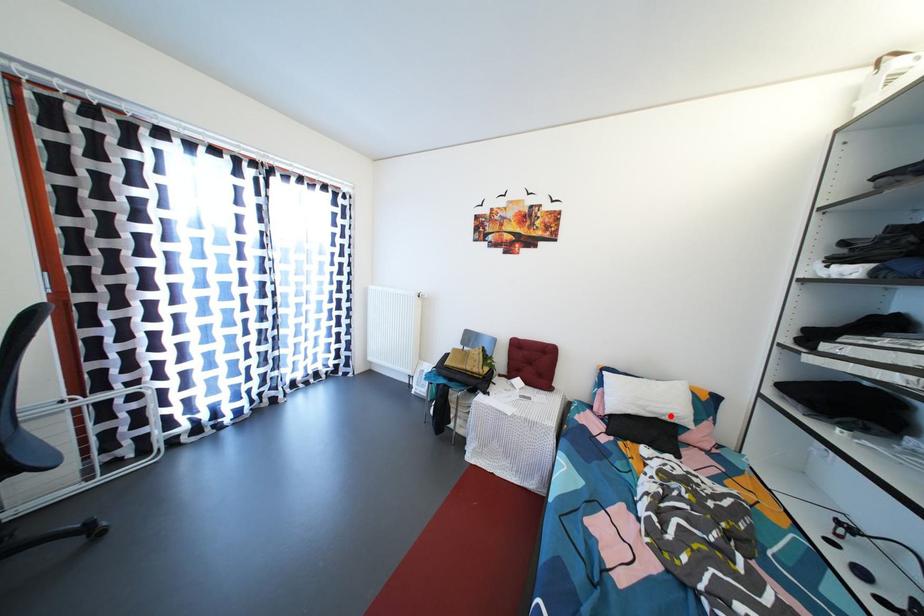
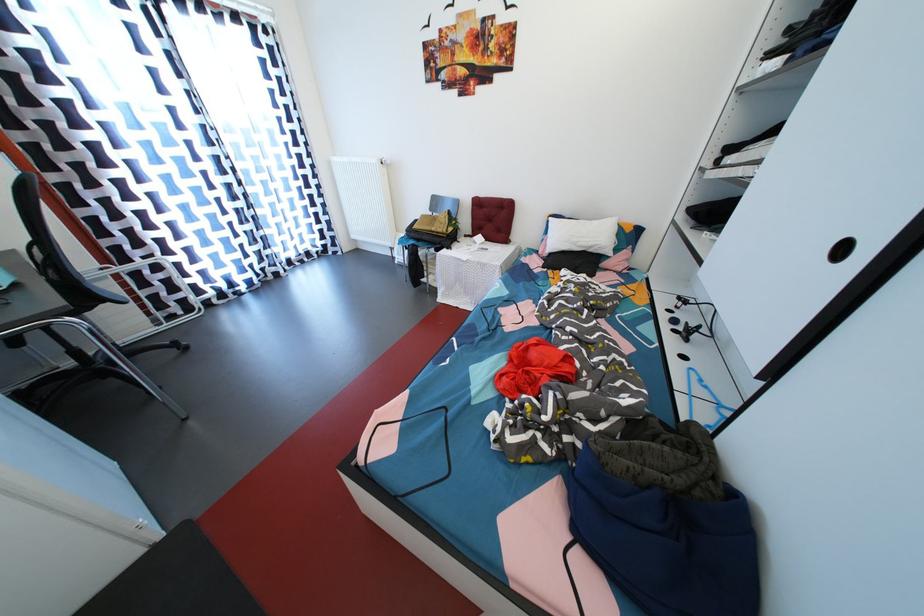
Question: A red point is marked in image1. In image2, is the corresponding 3D point closer to the camera or farther? Reply with the corresponding letter.

Choices:
 (A) The corresponding 3D point is closer.
 (B) The corresponding 3D point is farther.

Answer: (A)